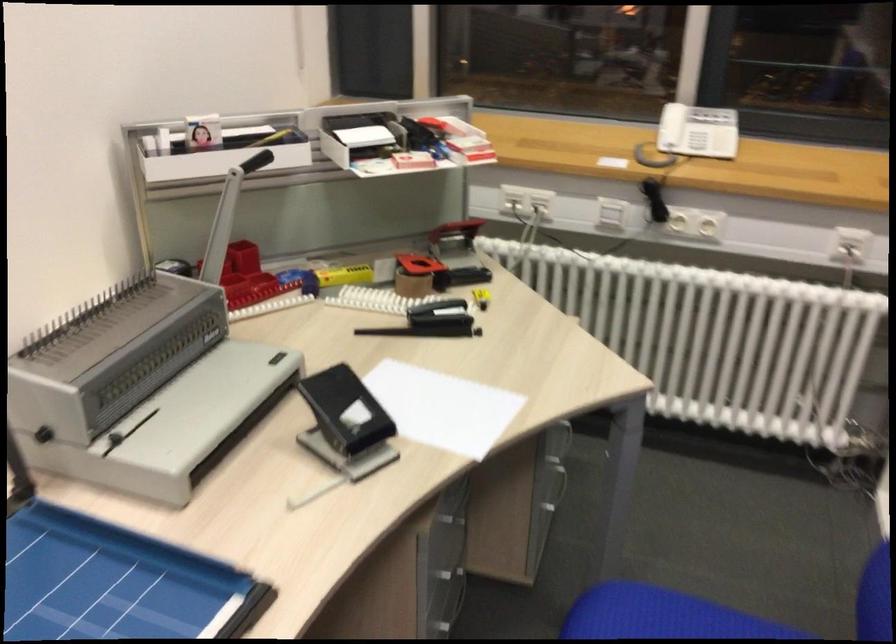
Where would you sit the chair sitting surface? Please return your answer as a coordinate pair (x, y).

(713, 611)